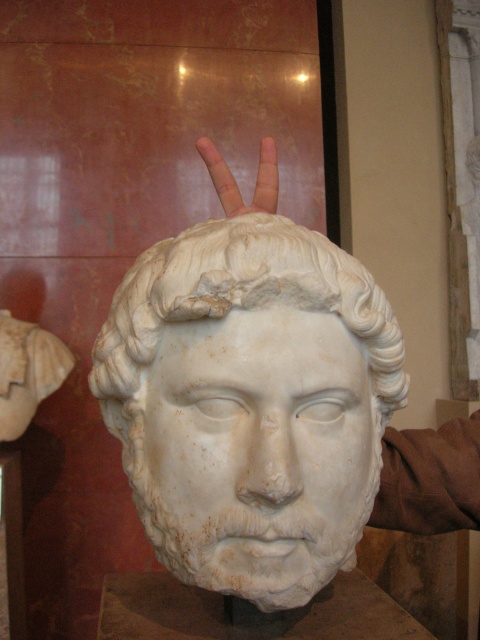
Can you confirm if white marble head at center is smaller than skinny flesh at center?

Actually, white marble head at center might be larger than skinny flesh at center.

Find the location of a particular element. The image size is (480, 640). white marble head at center is located at coordinates (262, 449).